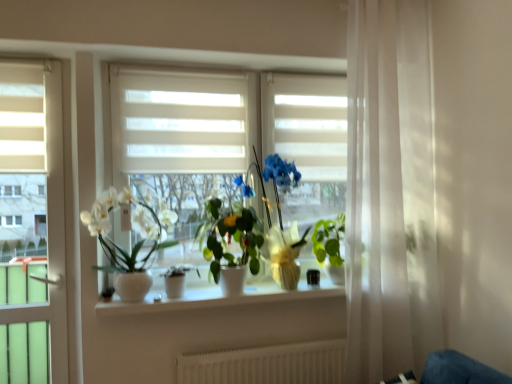
Question: Is green glossy plant at center, which appears as the fourth houseplant when viewed from the left, at the back of green glossy plant at center, which is the third houseplant in left-to-right order?

Choices:
 (A) no
 (B) yes

Answer: (A)

Question: Is green glossy plant at center, which is the third houseplant in left-to-right order, completely or partially outside of green glossy plant at center, the 1th houseplant viewed from the right?

Choices:
 (A) yes
 (B) no

Answer: (A)

Question: From the image's perspective, is green glossy plant at center, which appears as the second houseplant when viewed from the right, on top of green glossy plant at center, the 1th houseplant viewed from the right?

Choices:
 (A) no
 (B) yes

Answer: (B)

Question: Is green glossy plant at center, which appears as the second houseplant when viewed from the right, behind green glossy plant at center, which appears as the fourth houseplant when viewed from the left?

Choices:
 (A) no
 (B) yes

Answer: (A)

Question: Is green glossy plant at center, which appears as the fourth houseplant when viewed from the left, inside green glossy plant at center, which appears as the second houseplant when viewed from the right?

Choices:
 (A) yes
 (B) no

Answer: (B)

Question: From a real-world perspective, is green glossy plant at center, which appears as the second houseplant when viewed from the right, located beneath green glossy plant at center, which appears as the fourth houseplant when viewed from the left?

Choices:
 (A) no
 (B) yes

Answer: (A)

Question: Does white glossy pot at left, positioned as the 1th houseplant in left-to-right order, appear on the left side of matte white pot at center, which is the 2th houseplant from left to right?

Choices:
 (A) yes
 (B) no

Answer: (A)

Question: Could matte white pot at center, the 3th houseplant when ordered from right to left, be considered to be inside white glossy pot at left, positioned as the 1th houseplant in left-to-right order?

Choices:
 (A) yes
 (B) no

Answer: (A)

Question: Considering the relative sizes of white glossy pot at left, acting as the fourth houseplant starting from the right, and matte white pot at center, the 3th houseplant when ordered from right to left, in the image provided, is white glossy pot at left, acting as the fourth houseplant starting from the right, wider than matte white pot at center, the 3th houseplant when ordered from right to left,?

Choices:
 (A) yes
 (B) no

Answer: (A)

Question: From the image's perspective, is white glossy pot at left, positioned as the 1th houseplant in left-to-right order, under matte white pot at center, the 3th houseplant when ordered from right to left?

Choices:
 (A) no
 (B) yes

Answer: (A)

Question: Is white glossy pot at left, positioned as the 1th houseplant in left-to-right order, outside of matte white pot at center, which is the 2th houseplant from left to right?

Choices:
 (A) yes
 (B) no

Answer: (A)

Question: Is white glossy pot at left, positioned as the 1th houseplant in left-to-right order, smaller than matte white pot at center, the 3th houseplant when ordered from right to left?

Choices:
 (A) yes
 (B) no

Answer: (B)

Question: From the image's perspective, would you say matte white pot at center, which is the 2th houseplant from left to right, is positioned over green glossy plant at center, which appears as the second houseplant when viewed from the right?

Choices:
 (A) no
 (B) yes

Answer: (A)